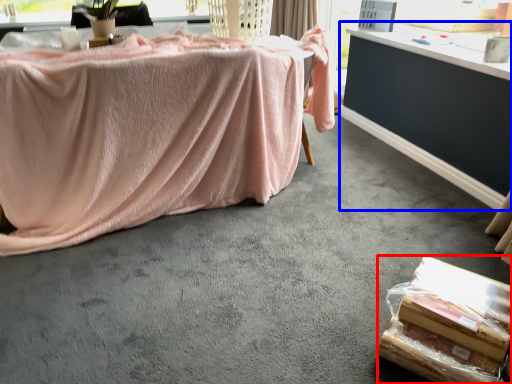
Question: Which object appears closest to the camera in this image, food (highlighted by a red box) or table (highlighted by a blue box)?

Choices:
 (A) food
 (B) table

Answer: (A)